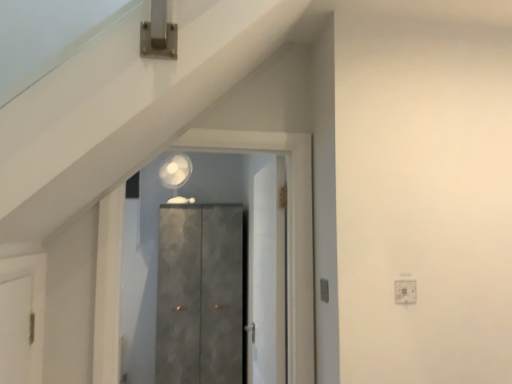
Describe the element at coordinates (268, 277) in the screenshot. I see `white matte door at center, placed as the 2th door when sorted from front to back` at that location.

Find the location of a particular element. The image size is (512, 384). matte gray cabinet at center, which appears as the 1th door when viewed from the front is located at coordinates (288, 228).

Locate an element on the screen. white matte door at center, placed as the 2th door when sorted from front to back is located at coordinates (268, 277).

Is point (183, 263) positioned behind point (311, 174)?

Yes, point (183, 263) is farther from viewer.

How many degrees apart are the facing directions of matte gray cabinet at center, which appears as the 1th door when viewed from the back, and matte gray cabinet at center, which appears as the 1th door when viewed from the front?

180 degrees separate the facing orientations of matte gray cabinet at center, which appears as the 1th door when viewed from the back, and matte gray cabinet at center, which appears as the 1th door when viewed from the front.

From a real-world perspective, who is located higher, matte gray cabinet at center, the third door from the front, or matte gray cabinet at center, which appears as the 1th door when viewed from the front?

matte gray cabinet at center, which appears as the 1th door when viewed from the front.

Between white matte door at center, placed as the 2th door when sorted from front to back, and matte gray cabinet at center, the third door from the front, which one has smaller width?

white matte door at center, placed as the 2th door when sorted from front to back.

From the image's perspective, does white matte door at center, which ranks as the 2th door in back-to-front order, appear lower than matte gray cabinet at center, which appears as the 1th door when viewed from the back?

Incorrect, from the image's perspective, white matte door at center, which ranks as the 2th door in back-to-front order, is higher than matte gray cabinet at center, which appears as the 1th door when viewed from the back.

Measure the distance between white matte door at center, which ranks as the 2th door in back-to-front order, and matte gray cabinet at center, which appears as the 1th door when viewed from the back.

A distance of 5.35 feet exists between white matte door at center, which ranks as the 2th door in back-to-front order, and matte gray cabinet at center, which appears as the 1th door when viewed from the back.

Considering the positions of objects white matte door at center, which ranks as the 2th door in back-to-front order, and matte gray cabinet at center, the third door from the front, in the image provided, who is in front, white matte door at center, which ranks as the 2th door in back-to-front order, or matte gray cabinet at center, the third door from the front,?

white matte door at center, which ranks as the 2th door in back-to-front order, is closer to the camera.

From a real-world perspective, which is physically above, matte gray cabinet at center, which appears as the 3th door when viewed from the back, or matte gray cabinet at center, the third door from the front?

In real-world perspective, matte gray cabinet at center, which appears as the 3th door when viewed from the back, is above.

Is matte gray cabinet at center, which appears as the 3th door when viewed from the back, aimed at matte gray cabinet at center, which appears as the 1th door when viewed from the back?

Yes, matte gray cabinet at center, which appears as the 3th door when viewed from the back, faces towards matte gray cabinet at center, which appears as the 1th door when viewed from the back.

Is matte gray cabinet at center, which appears as the 3th door when viewed from the back, at the right side of matte gray cabinet at center, the third door from the front?

Indeed, matte gray cabinet at center, which appears as the 3th door when viewed from the back, is positioned on the right side of matte gray cabinet at center, the third door from the front.

How different are the orientations of matte gray cabinet at center, which appears as the 1th door when viewed from the front, and matte gray cabinet at center, which appears as the 1th door when viewed from the back, in degrees?

matte gray cabinet at center, which appears as the 1th door when viewed from the front, and matte gray cabinet at center, which appears as the 1th door when viewed from the back, are facing 180 degrees away from each other.

Can you confirm if white matte door at center, which ranks as the 2th door in back-to-front order, is thinner than matte gray cabinet at center, which appears as the 3th door when viewed from the back?

Yes, white matte door at center, which ranks as the 2th door in back-to-front order, is thinner than matte gray cabinet at center, which appears as the 3th door when viewed from the back.

Can you confirm if white matte door at center, placed as the 2th door when sorted from front to back, is positioned to the right of matte gray cabinet at center, which appears as the 3th door when viewed from the back?

Yes.

From a real-world perspective, is white matte door at center, which ranks as the 2th door in back-to-front order, above or below matte gray cabinet at center, which appears as the 3th door when viewed from the back?

Clearly, from a real-world perspective, white matte door at center, which ranks as the 2th door in back-to-front order, is below matte gray cabinet at center, which appears as the 3th door when viewed from the back.

Does white matte door at center, which ranks as the 2th door in back-to-front order, have a greater height compared to matte gray cabinet at center, which appears as the 1th door when viewed from the front?

Yes, white matte door at center, which ranks as the 2th door in back-to-front order, is taller than matte gray cabinet at center, which appears as the 1th door when viewed from the front.

Can you confirm if matte gray cabinet at center, the third door from the front, is smaller than white matte door at center, placed as the 2th door when sorted from front to back?

Incorrect, matte gray cabinet at center, the third door from the front, is not smaller in size than white matte door at center, placed as the 2th door when sorted from front to back.

Which of these two, matte gray cabinet at center, the third door from the front, or white matte door at center, placed as the 2th door when sorted from front to back, is thinner?

white matte door at center, placed as the 2th door when sorted from front to back.

Is matte gray cabinet at center, the third door from the front, in contact with white matte door at center, placed as the 2th door when sorted from front to back?

There is a gap between matte gray cabinet at center, the third door from the front, and white matte door at center, placed as the 2th door when sorted from front to back.

Considering the points (211, 319) and (263, 268), which point is behind, point (211, 319) or point (263, 268)?

The point (211, 319) is more distant.

Is matte gray cabinet at center, which appears as the 3th door when viewed from the back, to the left of white matte door at center, placed as the 2th door when sorted from front to back, from the viewer's perspective?

Yes, matte gray cabinet at center, which appears as the 3th door when viewed from the back, is to the left of white matte door at center, placed as the 2th door when sorted from front to back.

Can you tell me how much matte gray cabinet at center, which appears as the 1th door when viewed from the front, and white matte door at center, which ranks as the 2th door in back-to-front order, differ in facing direction?

matte gray cabinet at center, which appears as the 1th door when viewed from the front, and white matte door at center, which ranks as the 2th door in back-to-front order, are facing 87.2 degrees away from each other.

Would you say white matte door at center, placed as the 2th door when sorted from front to back, is part of matte gray cabinet at center, which appears as the 3th door when viewed from the back,'s contents?

No, white matte door at center, placed as the 2th door when sorted from front to back, is not a part of matte gray cabinet at center, which appears as the 3th door when viewed from the back.

What are the coordinates of `door that appears on the left of matte gray cabinet at center, which appears as the 1th door when viewed from the front` in the screenshot? It's located at (200, 294).

Locate an element on the screen. The width and height of the screenshot is (512, 384). the 2nd door to the right of the matte gray cabinet at center, the third door from the front, starting your count from the anchor is located at coordinates (268, 277).

When comparing their distances from matte gray cabinet at center, which appears as the 3th door when viewed from the back, does matte gray cabinet at center, the third door from the front, or white matte door at center, which ranks as the 2th door in back-to-front order, seem further?

matte gray cabinet at center, the third door from the front, is further to matte gray cabinet at center, which appears as the 3th door when viewed from the back.

Which object lies further to the anchor point white matte door at center, placed as the 2th door when sorted from front to back, matte gray cabinet at center, which appears as the 3th door when viewed from the back, or matte gray cabinet at center, which appears as the 1th door when viewed from the back?

matte gray cabinet at center, which appears as the 1th door when viewed from the back, is positioned further to the anchor white matte door at center, placed as the 2th door when sorted from front to back.

When comparing their distances from matte gray cabinet at center, the third door from the front, does white matte door at center, placed as the 2th door when sorted from front to back, or matte gray cabinet at center, which appears as the 1th door when viewed from the front, seem closer?

white matte door at center, placed as the 2th door when sorted from front to back, is closer to matte gray cabinet at center, the third door from the front.

Considering their positions, is matte gray cabinet at center, which appears as the 1th door when viewed from the back, positioned closer to white matte door at center, placed as the 2th door when sorted from front to back, than matte gray cabinet at center, which appears as the 1th door when viewed from the front?

matte gray cabinet at center, which appears as the 1th door when viewed from the front, lies closer to white matte door at center, placed as the 2th door when sorted from front to back, than the other object.

Estimate the real-world distances between objects in this image. Which object is closer to matte gray cabinet at center, which appears as the 3th door when viewed from the back, white matte door at center, placed as the 2th door when sorted from front to back, or matte gray cabinet at center, the third door from the front?

white matte door at center, placed as the 2th door when sorted from front to back, is closer to matte gray cabinet at center, which appears as the 3th door when viewed from the back.

Estimate the real-world distances between objects in this image. Which object is further from matte gray cabinet at center, which appears as the 1th door when viewed from the back, matte gray cabinet at center, which appears as the 1th door when viewed from the front, or white matte door at center, which ranks as the 2th door in back-to-front order?

matte gray cabinet at center, which appears as the 1th door when viewed from the front, is further to matte gray cabinet at center, which appears as the 1th door when viewed from the back.

In order to click on door between matte gray cabinet at center, which appears as the 3th door when viewed from the back, and matte gray cabinet at center, which appears as the 1th door when viewed from the back, from front to back in this screenshot , I will do `click(268, 277)`.